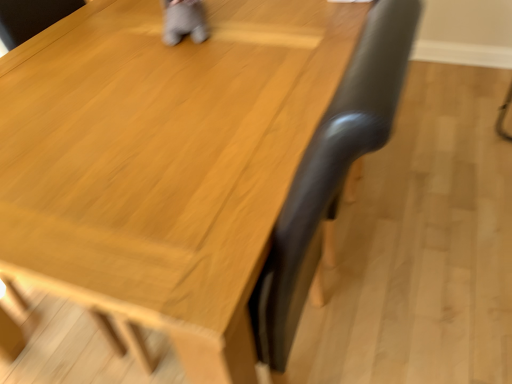
Question: Should I look upward or downward to see black leather swivel chair at right?

Choices:
 (A) down
 (B) up

Answer: (B)